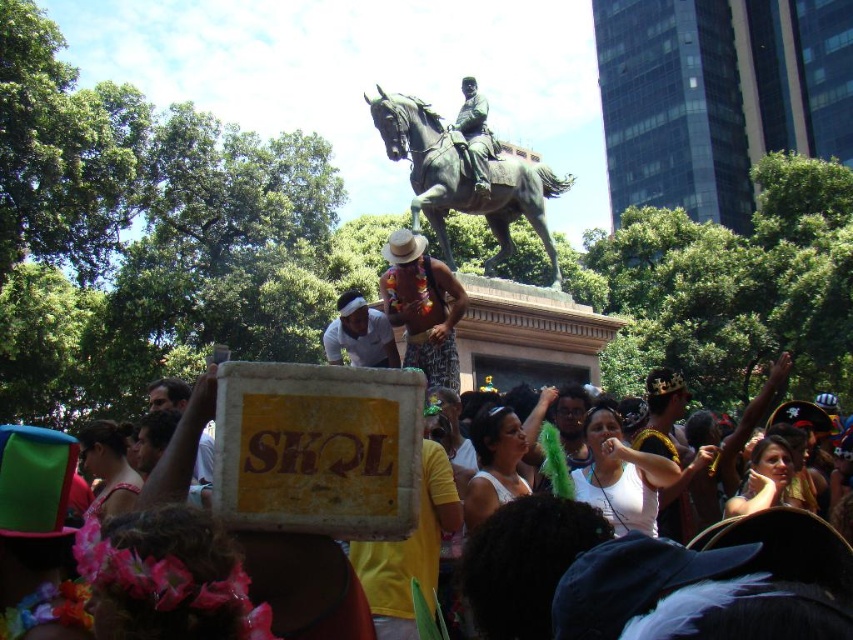
You are a photographer at the festival and want to capture both the white cardboard sign at center and the white matte shirt at center in a single frame. Since the camera can only focus on one object at a time, which object should you focus on to ensure the other remains recognizable in the background?

You should focus on the white cardboard sign at center because it is larger than the white matte shirt at center, making it easier to capture details while the smaller shirt will still be recognizable in the background.

You are at the festival and want to read the message on the white cardboard sign at center. However, someone wearing a white matte shirt at center is blocking your view. Can you see the sign clearly?

The white cardboard sign at center is in front of the white matte shirt at center, so you can see the sign clearly because it is not blocked by the shirt.

You are a photographer at the festival trying to capture a clear shot of both the white cardboard sign at center and the white matte shirt at center. Since you want both to be visible in your photo, which object should you focus on first to ensure depth of field?

The white cardboard sign at center is taller than the white matte shirt at center, so focusing on the taller object first will help ensure both are in focus.